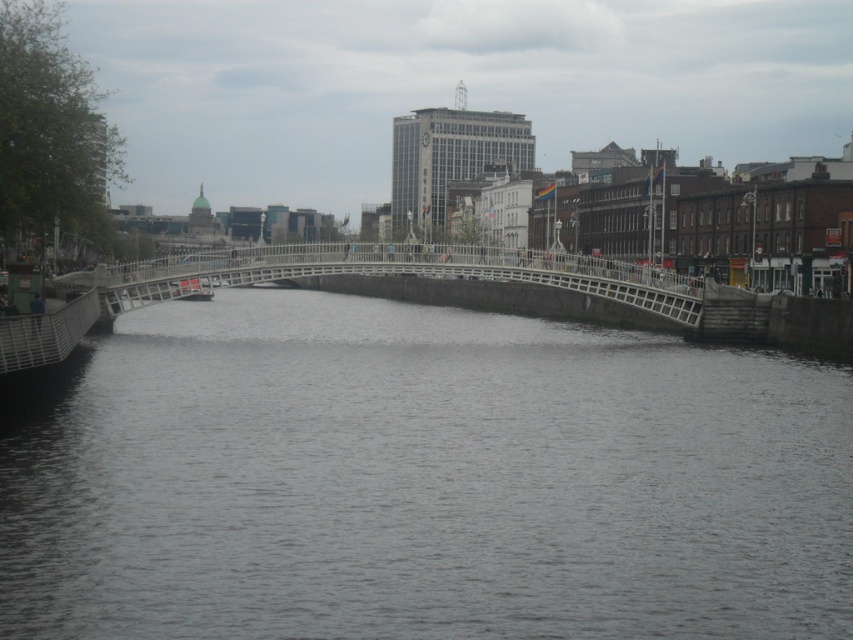
Between point (570, 380) and point (645, 294), which one is positioned behind?

Point (645, 294)

Locate an element on the screen. This screenshot has width=853, height=640. gray concrete water at center is located at coordinates (419, 480).

Which is above, white metal bridge at center or metallic gray boat at center?

Positioned higher is white metal bridge at center.

Who is positioned more to the left, white metal bridge at center or metallic gray boat at center?

Positioned to the left is metallic gray boat at center.

The image size is (853, 640). What do you see at coordinates (404, 273) in the screenshot? I see `white metal bridge at center` at bounding box center [404, 273].

You are a GUI agent. You are given a task and a screenshot of the screen. Output one action in this format:
    pyautogui.click(x=<x>, y=<y>)
    Task: Click on the white metal bridge at center
    
    Given the screenshot: What is the action you would take?
    pyautogui.click(x=404, y=273)

Between gray concrete water at center and metallic gray boat at center, which one appears on the right side from the viewer's perspective?

gray concrete water at center is more to the right.

Is point (727, 544) positioned after point (198, 292)?

No, it is in front of (198, 292).

Who is more distant from viewer, (431,416) or (193,291)?

Positioned behind is point (193,291).

The height and width of the screenshot is (640, 853). I want to click on gray concrete water at center, so click(x=419, y=480).